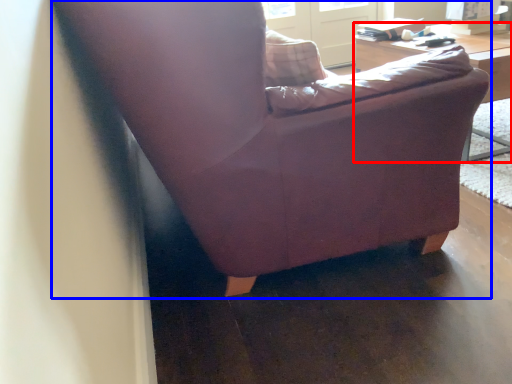
Question: Which of the following is the farthest to the observer, table (highlighted by a red box) or chair (highlighted by a blue box)?

Choices:
 (A) table
 (B) chair

Answer: (A)